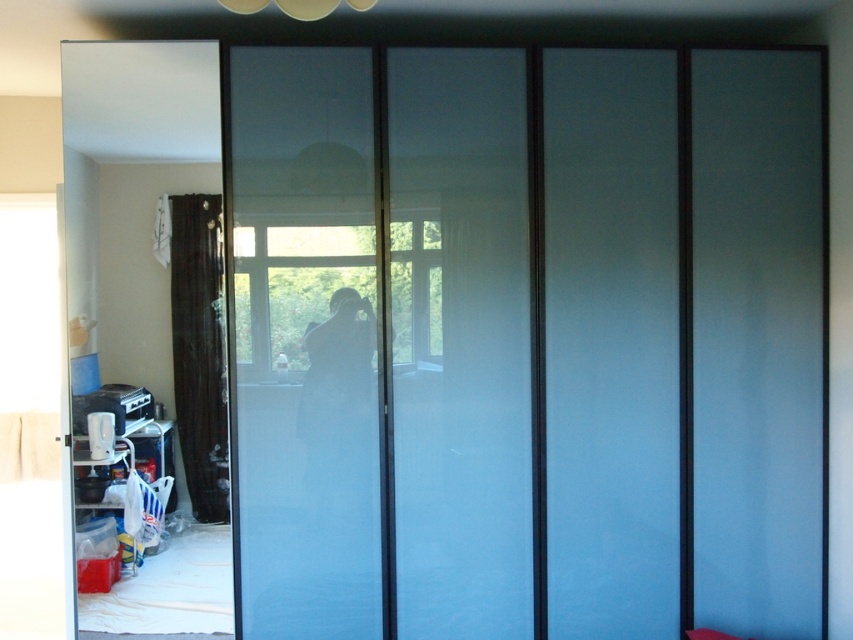
Question: Does frosted glass door at center have a greater width compared to brown velvet curtain at left?

Choices:
 (A) no
 (B) yes

Answer: (B)

Question: Is frosted glass door at center below brown velvet curtain at left?

Choices:
 (A) yes
 (B) no

Answer: (B)

Question: Is frosted glass door at center to the left of brown velvet curtain at left from the viewer's perspective?

Choices:
 (A) no
 (B) yes

Answer: (A)

Question: Which object is closer to the camera taking this photo?

Choices:
 (A) brown velvet curtain at left
 (B) frosted glass door at center

Answer: (A)